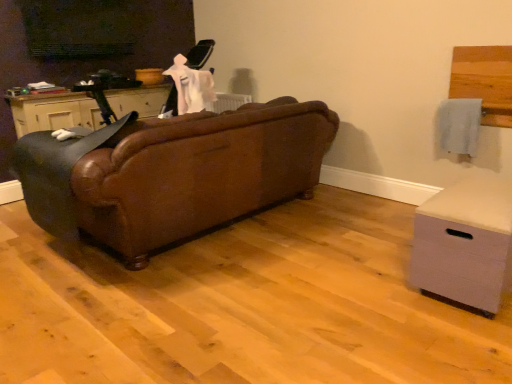
Question: From the image's perspective, is matte black cabinet at left beneath light gray fabric chest of drawers at lower right?

Choices:
 (A) no
 (B) yes

Answer: (A)

Question: Is matte black cabinet at left outside light gray fabric chest of drawers at lower right?

Choices:
 (A) yes
 (B) no

Answer: (A)

Question: Is matte black cabinet at left further to camera compared to light gray fabric chest of drawers at lower right?

Choices:
 (A) no
 (B) yes

Answer: (B)

Question: From the image's perspective, is matte black cabinet at left on top of light gray fabric chest of drawers at lower right?

Choices:
 (A) no
 (B) yes

Answer: (B)

Question: Is matte black cabinet at left facing away from light gray fabric chest of drawers at lower right?

Choices:
 (A) yes
 (B) no

Answer: (B)

Question: Looking at the image, does light gray fabric chest of drawers at lower right seem bigger or smaller compared to brown leather couch at center?

Choices:
 (A) small
 (B) big

Answer: (A)

Question: From the image's perspective, is light gray fabric chest of drawers at lower right located above or below brown leather couch at center?

Choices:
 (A) above
 (B) below

Answer: (B)

Question: From a real-world perspective, is light gray fabric chest of drawers at lower right positioned above or below brown leather couch at center?

Choices:
 (A) below
 (B) above

Answer: (A)

Question: In the image, is light gray fabric chest of drawers at lower right positioned in front of or behind brown leather couch at center?

Choices:
 (A) behind
 (B) front

Answer: (B)

Question: Looking at the image, does matte black cabinet at left seem bigger or smaller compared to brown leather couch at center?

Choices:
 (A) small
 (B) big

Answer: (A)

Question: Looking at their shapes, would you say matte black cabinet at left is wider or thinner than brown leather couch at center?

Choices:
 (A) thin
 (B) wide

Answer: (A)

Question: From a real-world perspective, relative to brown leather couch at center, is matte black cabinet at left vertically above or below?

Choices:
 (A) above
 (B) below

Answer: (A)

Question: Is matte black cabinet at left in front of or behind brown leather couch at center in the image?

Choices:
 (A) behind
 (B) front

Answer: (A)

Question: In terms of height, does light gray fabric chest of drawers at lower right look taller or shorter compared to brown leather rocking chair at left?

Choices:
 (A) short
 (B) tall

Answer: (A)

Question: In the image, is light gray fabric chest of drawers at lower right on the left side or the right side of brown leather rocking chair at left?

Choices:
 (A) right
 (B) left

Answer: (A)